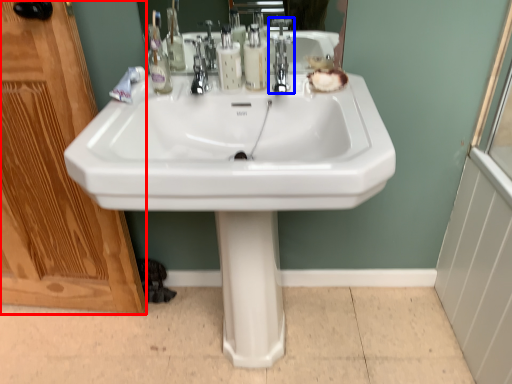
Question: Which of the following is the closest to the observer, screen door (highlighted by a red box) or tap (highlighted by a blue box)?

Choices:
 (A) screen door
 (B) tap

Answer: (A)